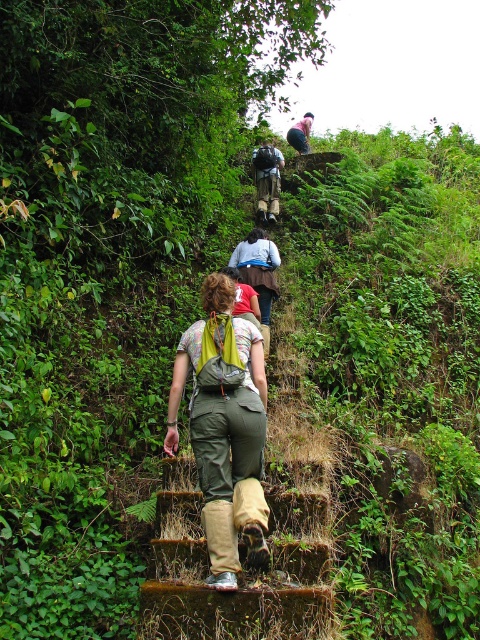
Question: Observing the image, what is the correct spatial positioning of brown wood stairs at center in reference to matte khaki pants at center?

Choices:
 (A) above
 (B) below

Answer: (B)

Question: Is brown wood stairs at center positioned before matte khaki pants at center?

Choices:
 (A) no
 (B) yes

Answer: (B)

Question: Can you confirm if brown wood stairs at center is positioned below matte khaki pants at center?

Choices:
 (A) yes
 (B) no

Answer: (A)

Question: Among these objects, which one is nearest to the camera?

Choices:
 (A) brown wood stairs at center
 (B) matte khaki pants at center

Answer: (A)